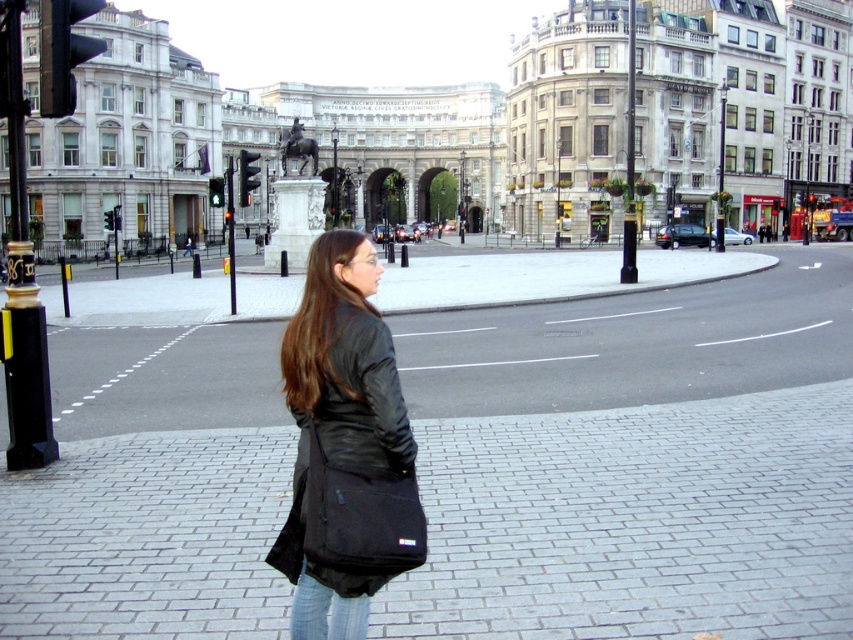
In the scene shown: You are a pedestrian standing at the edge of the road. You see a smooth gray pavement at lower center and a black metal traffic light at left. Which object is closer to the road edge?

The smooth gray pavement at lower center is located below the black metal traffic light at left, meaning it is closer to the road edge than the traffic light.